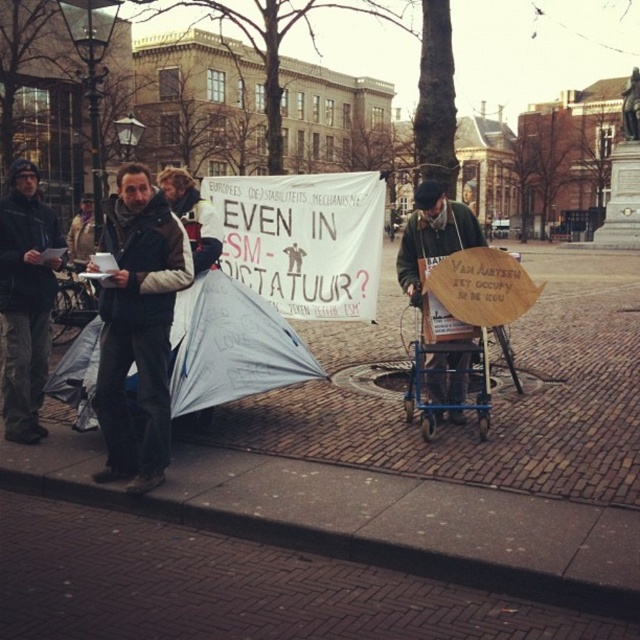
You are standing in the plaza and want to place a 2.5 meter long banner on the ground between you and the brick pavement at center. Is there enough space to lay it out fully without folding?

The distance between you and the brick pavement at center is 3.82 meters, which is greater than the banner length of 2.5 meters. Therefore, the banner can be laid out fully without folding.

You are standing at the center of the square and want to place a new bench exactly 2 meters north of the wooden signboard at center. What coordinates would you mark for the bench?

The wooden signboard at center is located at coordinates point (433, 234). To place the bench 2 meters north, you would add 2 meters to the y coordinate, resulting in coordinates point (435, 234).